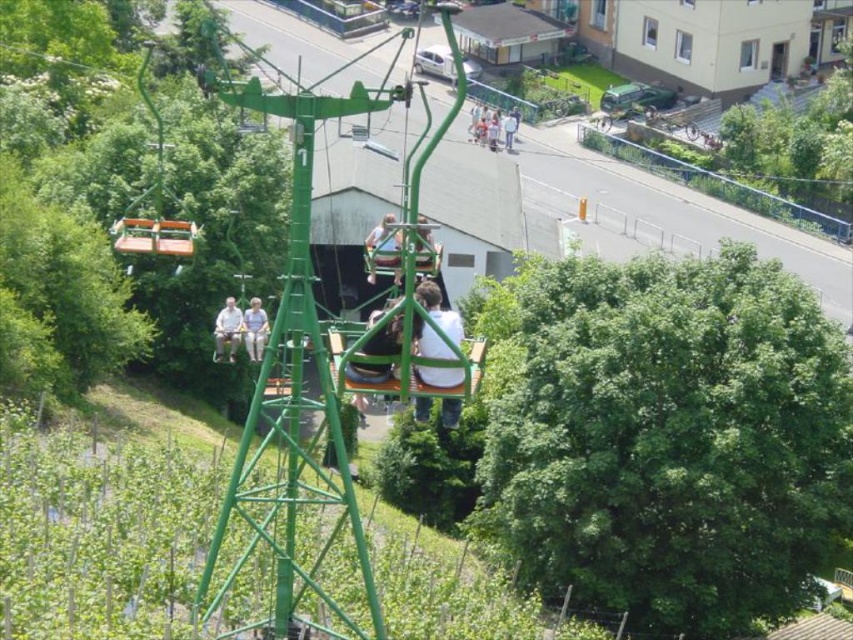
You are a photographer trying to capture a clear photo of the green metallic cable car at center and the light blue shirt at center. Since you want both subjects to be visible, which one should you focus on first to ensure proper focus, considering their sizes?

The green metallic cable car at center is bigger than the light blue shirt at center, so you should focus on the green metallic cable car at center first to ensure it is in focus, as larger objects require more precise focus adjustments.

You are standing at the base of the chairlift and want to identify the clothing items of the two passengers. Which clothing item is closer to you, the light brown leather jacket at lower left or the light gray fabric pants at center?

The light brown leather jacket at lower left is closer to you because it is further to the viewer than the light gray fabric pants at center.